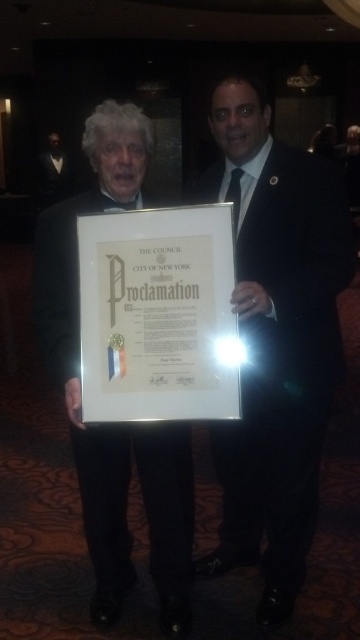
You are an event planner organizing a photo shoot for a city council event. You need to ensure that the black suit at center and the white paper at center are positioned correctly for a professional photo. Based on the scene description, which object should be placed lower in the frame?

The black suit at center should be placed lower in the frame because it is located below the white paper at center according to the description.

Based on the photo, you are attending a formal event and see a black suit at center and a white paper at center. Which object is located to the right of the other?

The black suit at center is positioned on the right side of white paper at center.